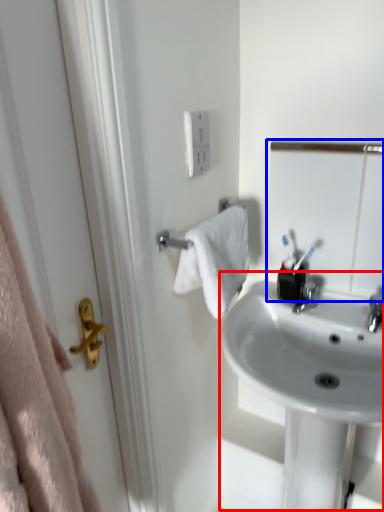
Question: Among these objects, which one is farthest to the camera, sink (highlighted by a red box) or mirror (highlighted by a blue box)?

Choices:
 (A) sink
 (B) mirror

Answer: (B)